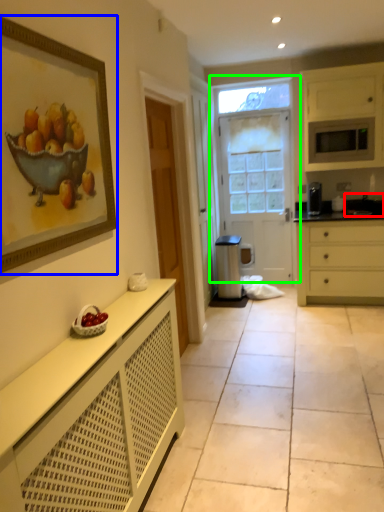
Question: Considering the real-world distances, which object is farthest from sink (highlighted by a red box)? picture frame (highlighted by a blue box) or door (highlighted by a green box)?

Choices:
 (A) picture frame
 (B) door

Answer: (A)